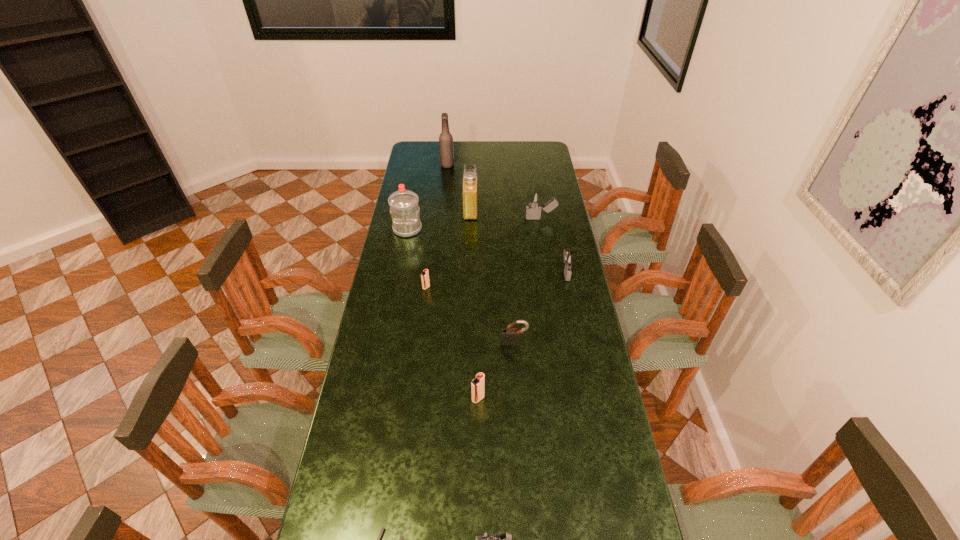
Find the location of a particular element. empty space between the nearer red igniter and the tallest object is located at coordinates (463, 282).

The width and height of the screenshot is (960, 540). Find the location of `object that is the fifth closest to the sixth farthest object`. object that is the fifth closest to the sixth farthest object is located at coordinates [x=569, y=260].

Identify the location of object that is the third nearest to the tallest igniter. (404, 208).

Locate which igniter is the third closest to the fifth farthest object. Please provide its 2D coordinates. Your answer should be formatted as a tuple, i.e. [(x, y)], where the tuple contains the x and y coordinates of a point satisfying the conditions above.

[(478, 384)]

Identify which igniter is the third closest to the nearest igniter. Please provide its 2D coordinates. Your answer should be formatted as a tuple, i.e. [(x, y)], where the tuple contains the x and y coordinates of a point satisfying the conditions above.

[(569, 260)]

Identify which gray igniter is the nearest to the second biggest gray igniter. Please provide its 2D coordinates. Your answer should be formatted as a tuple, i.e. [(x, y)], where the tuple contains the x and y coordinates of a point satisfying the conditions above.

[(534, 198)]

Choose which gray igniter is the second nearest neighbor to the third nearest object. Please provide its 2D coordinates. Your answer should be formatted as a tuple, i.e. [(x, y)], where the tuple contains the x and y coordinates of a point satisfying the conditions above.

[(569, 260)]

At what (x,y) coordinates should I click in order to perform the action: click on free space that satisfies the following two spatial constraints: 1. on the front-facing side of the second farthest gray igniter; 2. on the right side of the perfume. Please return your answer as a coordinate pair (x, y). The image size is (960, 540). Looking at the image, I should click on (468, 272).

The height and width of the screenshot is (540, 960). Identify the location of free point that satisfies the following two spatial constraints: 1. on the handle side of the nearer red igniter; 2. on the left side of the water bottle. (375, 399).

Image resolution: width=960 pixels, height=540 pixels. In order to click on free spot that satisfies the following two spatial constraints: 1. on the label of the farthest object; 2. on the back side of the farthest gray igniter in this screenshot , I will do `click(442, 219)`.